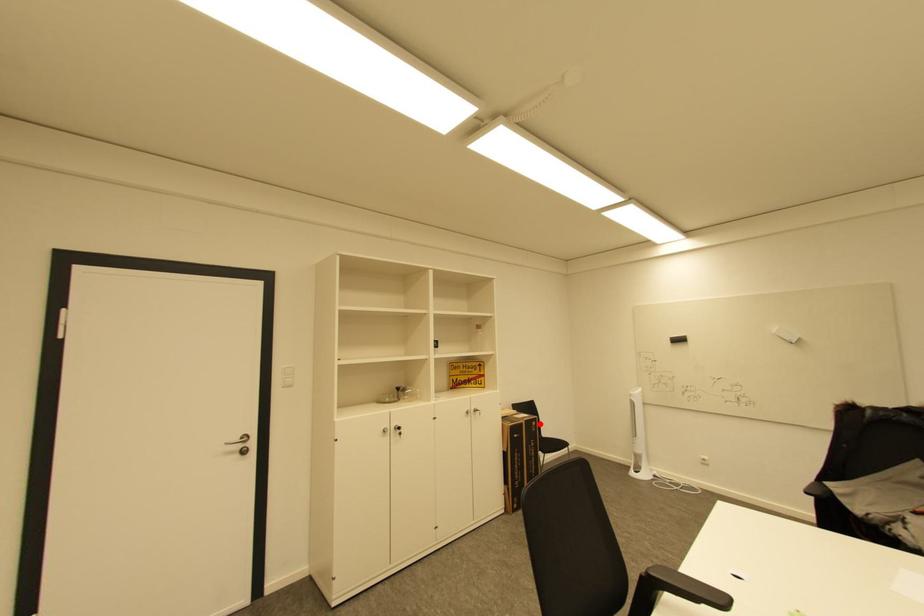
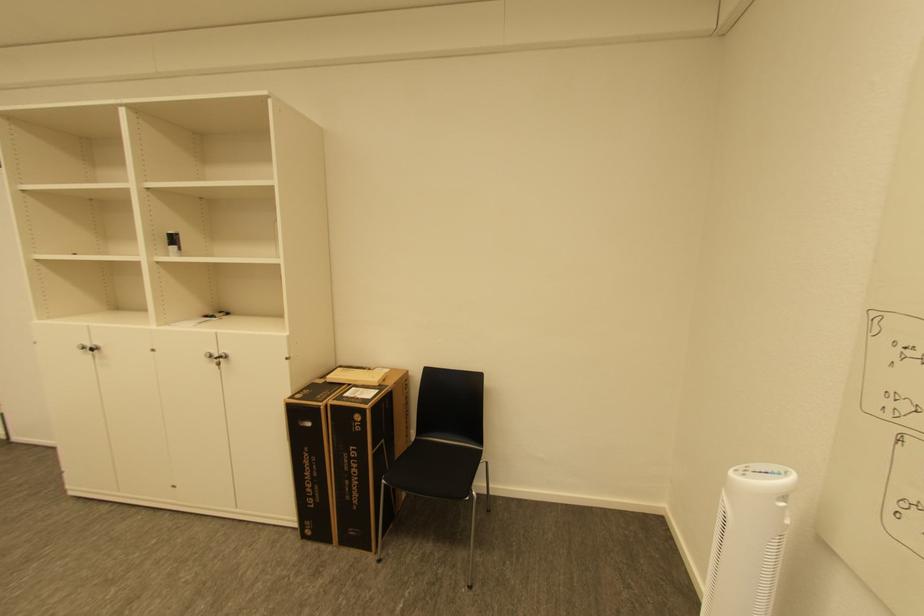
Question: I am providing you with two images of the same scene from different viewpoints. A red point is marked on the first image. Can you still see the location of the red point in image 2?

Choices:
 (A) Yes
 (B) No

Answer: (A)